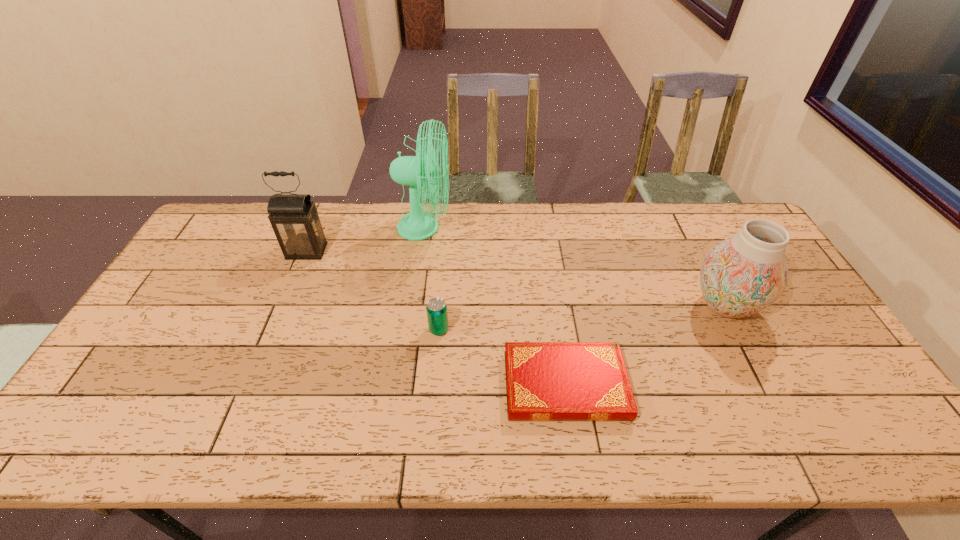
Identify the location of vacant position at the far left corner of the desktop. (262, 207).

Locate an element on the screen. This screenshot has height=540, width=960. vacant space at the far right corner of the desktop is located at coordinates (722, 211).

This screenshot has height=540, width=960. Find the location of `free spot between the rightmost object and the leftmost object`. free spot between the rightmost object and the leftmost object is located at coordinates (516, 278).

At what (x,y) coordinates should I click in order to perform the action: click on free area in between the beer can and the leftmost object. Please return your answer as a coordinate pair (x, y). Image resolution: width=960 pixels, height=540 pixels. Looking at the image, I should click on (372, 291).

The image size is (960, 540). In order to click on vacant area that lies between the beer can and the nearest object in this screenshot , I will do `click(502, 357)`.

The height and width of the screenshot is (540, 960). In order to click on unoccupied position between the rightmost object and the nearest object in this screenshot , I will do `click(645, 345)`.

This screenshot has height=540, width=960. I want to click on vacant region between the fourth tallest object and the leftmost object, so click(x=372, y=291).

Locate an element on the screen. Image resolution: width=960 pixels, height=540 pixels. vacant region between the second shortest object and the lantern is located at coordinates (372, 291).

The height and width of the screenshot is (540, 960). In order to click on free spot between the second shortest object and the hardback book in this screenshot , I will do `click(502, 357)`.

Locate an element on the screen. This screenshot has width=960, height=540. unoccupied area between the leftmost object and the fan is located at coordinates (366, 240).